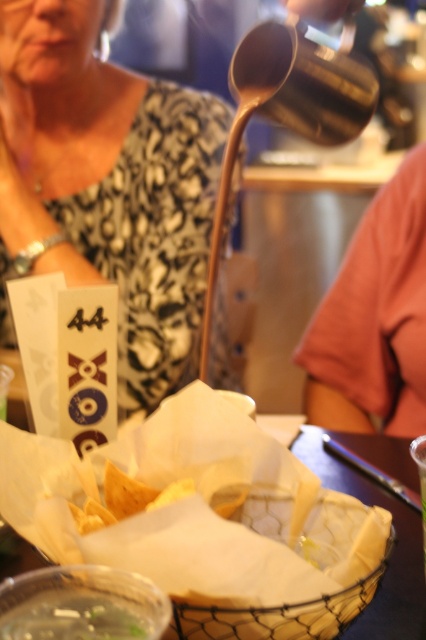
Question: Is matte black shirt at upper left above green translucent liquid at lower left?

Choices:
 (A) no
 (B) yes

Answer: (B)

Question: Is matte black shirt at upper left to the left of green translucent liquid at lower left from the viewer's perspective?

Choices:
 (A) no
 (B) yes

Answer: (B)

Question: Is matte black shirt at upper left thinner than green translucent liquid at lower left?

Choices:
 (A) no
 (B) yes

Answer: (A)